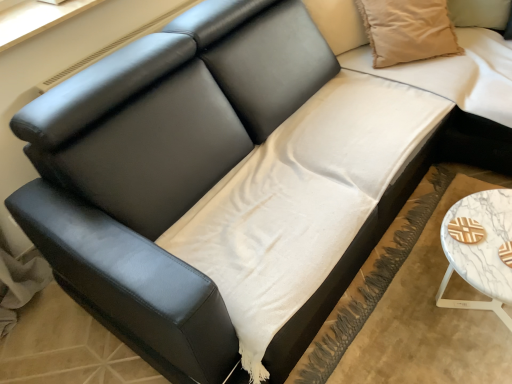
Identify the location of empty space that is ontop of white marble table at lower right (from a real-world perspective). coord(482,241).